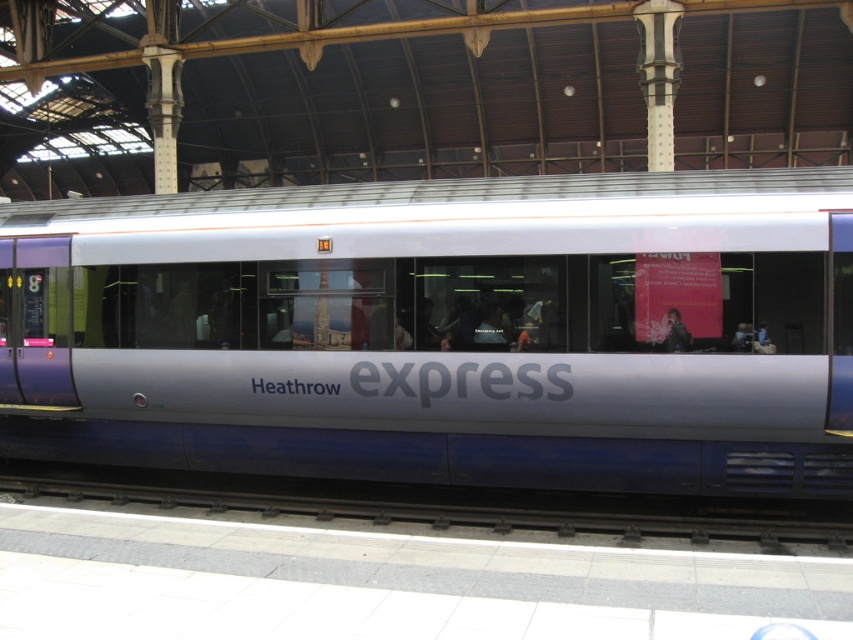
You are standing at point (700, 512) and want to walk to the train entrance located at point (219, 244). Is the train entrance in front of or behind you?

The train entrance at point (219, 244) is behind point (700, 512), so it is behind you.